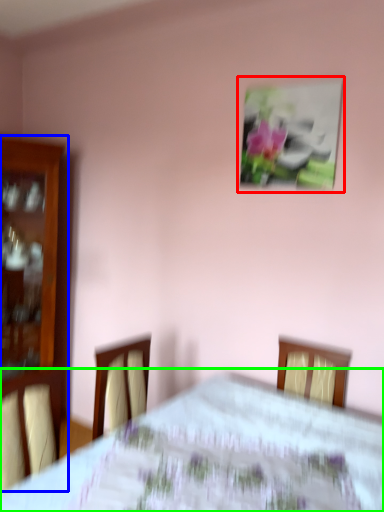
Question: Based on their relative distances, which object is nearer to picture frame (highlighted by a red box)? Choose from furniture (highlighted by a blue box) and bed (highlighted by a green box).

Choices:
 (A) furniture
 (B) bed

Answer: (B)